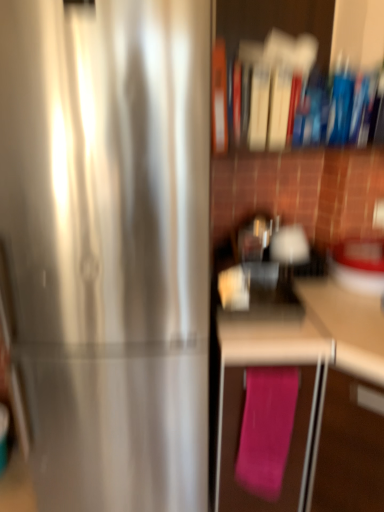
Question: Is pink fabric at lower right shorter than satin silver refrigerator at left?

Choices:
 (A) yes
 (B) no

Answer: (A)

Question: Are pink fabric at lower right and satin silver refrigerator at left making contact?

Choices:
 (A) no
 (B) yes

Answer: (A)

Question: Can satin silver refrigerator at left be found inside pink fabric at lower right?

Choices:
 (A) yes
 (B) no

Answer: (B)

Question: Can we say pink fabric at lower right lies outside satin silver refrigerator at left?

Choices:
 (A) yes
 (B) no

Answer: (A)

Question: Does pink fabric at lower right have a smaller size compared to satin silver refrigerator at left?

Choices:
 (A) yes
 (B) no

Answer: (B)

Question: Does pink fabric at lower right lie in front of satin silver refrigerator at left?

Choices:
 (A) yes
 (B) no

Answer: (A)

Question: Is pink fabric bath towel at lower right further to camera compared to satin silver refrigerator at left?

Choices:
 (A) yes
 (B) no

Answer: (A)

Question: Is pink fabric bath towel at lower right positioned with its back to satin silver refrigerator at left?

Choices:
 (A) yes
 (B) no

Answer: (B)

Question: Considering the relative sizes of pink fabric bath towel at lower right and satin silver refrigerator at left in the image provided, is pink fabric bath towel at lower right taller than satin silver refrigerator at left?

Choices:
 (A) yes
 (B) no

Answer: (B)

Question: Considering the relative sizes of pink fabric bath towel at lower right and satin silver refrigerator at left in the image provided, is pink fabric bath towel at lower right wider than satin silver refrigerator at left?

Choices:
 (A) yes
 (B) no

Answer: (B)

Question: Is pink fabric bath towel at lower right positioned before satin silver refrigerator at left?

Choices:
 (A) yes
 (B) no

Answer: (B)

Question: Is pink fabric bath towel at lower right to the left of satin silver refrigerator at left from the viewer's perspective?

Choices:
 (A) no
 (B) yes

Answer: (A)

Question: Considering the relative sizes of pink fabric at lower right and pink fabric bath towel at lower right in the image provided, is pink fabric at lower right smaller than pink fabric bath towel at lower right?

Choices:
 (A) yes
 (B) no

Answer: (B)